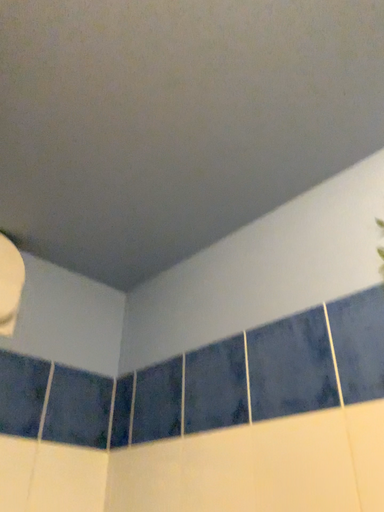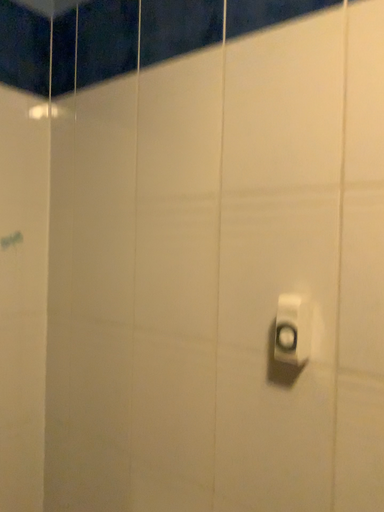
Question: How did the camera likely rotate when shooting the video?

Choices:
 (A) rotated left
 (B) rotated right

Answer: (B)